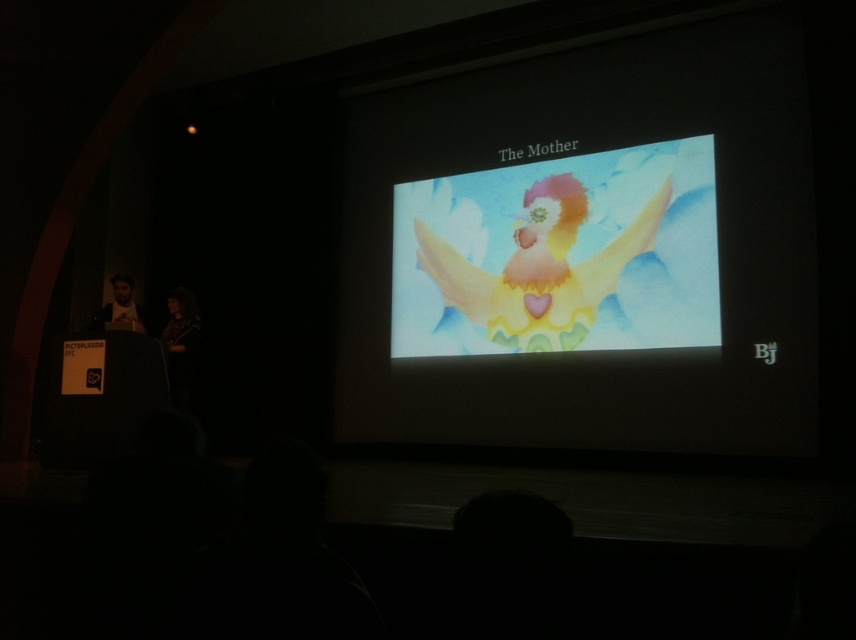
Question: Which point is farther from the camera taking this photo?

Choices:
 (A) (535, 339)
 (B) (180, 298)

Answer: (A)

Question: Is matte black jacket at lower left above beige fabric speaker at left?

Choices:
 (A) yes
 (B) no

Answer: (B)

Question: Is pastel watercolor angel at center wider than beige fabric speaker at left?

Choices:
 (A) yes
 (B) no

Answer: (A)

Question: Is pastel watercolor angel at center below matte black jacket at lower left?

Choices:
 (A) no
 (B) yes

Answer: (A)

Question: Which point is farther to the camera?

Choices:
 (A) (132, 323)
 (B) (180, 339)
 (C) (562, 323)

Answer: (C)

Question: Estimate the real-world distances between objects in this image. Which object is closer to the matte black jacket at lower left?

Choices:
 (A) beige fabric speaker at left
 (B) pastel watercolor angel at center

Answer: (A)